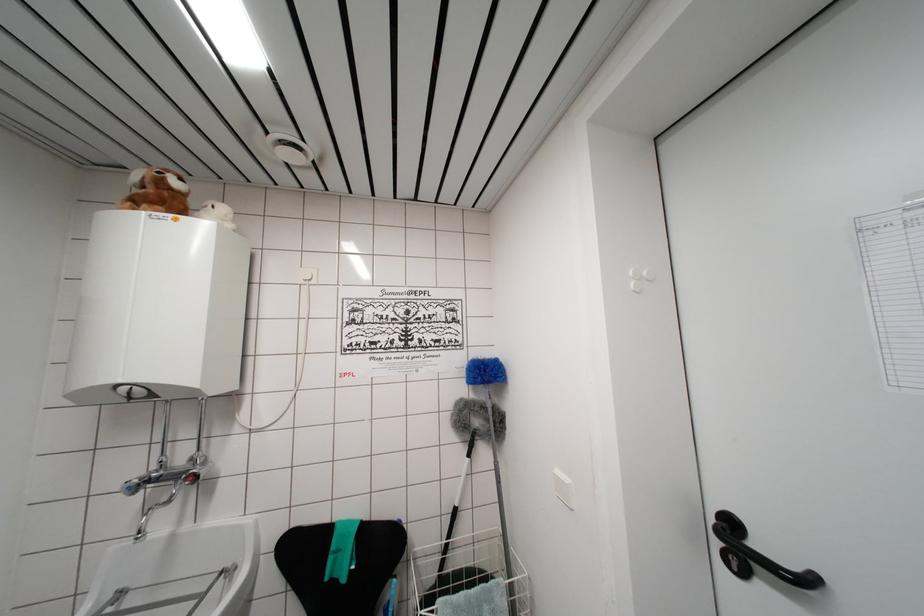
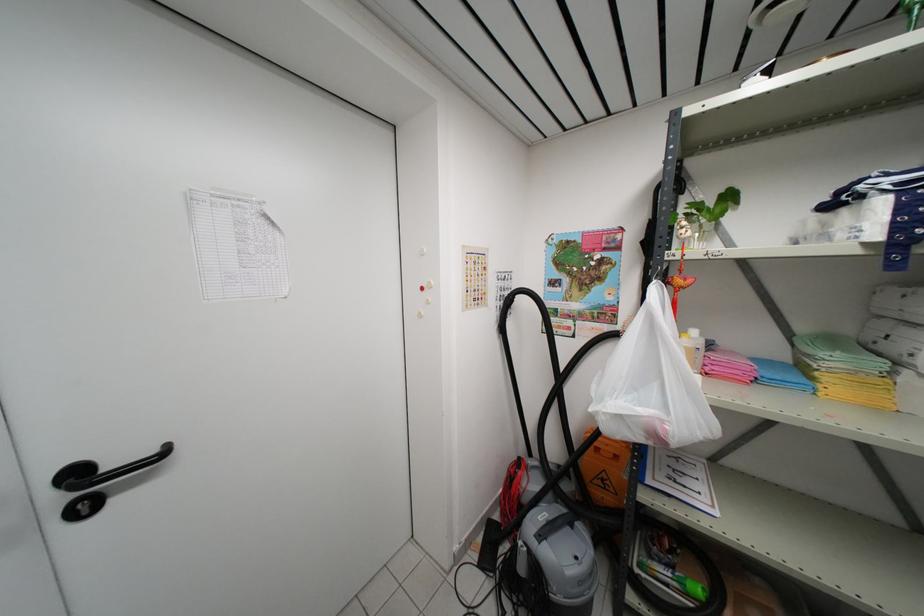
Find the pixel in the second image that matches the point at 735,562 in the first image.

(83, 512)